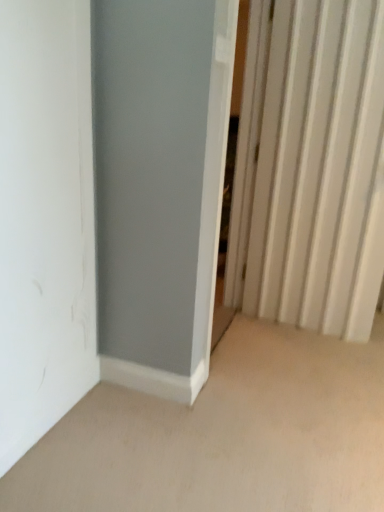
Question: From a real-world perspective, does white matte door at left stand above white plastic radiator at right?

Choices:
 (A) no
 (B) yes

Answer: (A)

Question: Can you confirm if white matte door at left is taller than white plastic radiator at right?

Choices:
 (A) yes
 (B) no

Answer: (B)

Question: Considering the relative sizes of white matte door at left and white plastic radiator at right in the image provided, is white matte door at left bigger than white plastic radiator at right?

Choices:
 (A) no
 (B) yes

Answer: (A)

Question: Considering the relative positions of white matte door at left and white plastic radiator at right in the image provided, is white matte door at left to the left of white plastic radiator at right from the viewer's perspective?

Choices:
 (A) no
 (B) yes

Answer: (B)

Question: Is white matte door at left positioned before white plastic radiator at right?

Choices:
 (A) yes
 (B) no

Answer: (A)

Question: Does white matte door at left have a lesser height compared to white plastic radiator at right?

Choices:
 (A) no
 (B) yes

Answer: (B)

Question: Does white plastic radiator at right have a larger size compared to white matte door at left?

Choices:
 (A) no
 (B) yes

Answer: (B)

Question: From a real-world perspective, is white plastic radiator at right located higher than white matte door at left?

Choices:
 (A) yes
 (B) no

Answer: (A)

Question: Is white matte door at left surrounded by white plastic radiator at right?

Choices:
 (A) yes
 (B) no

Answer: (B)

Question: From a real-world perspective, is white plastic radiator at right positioned under white matte door at left based on gravity?

Choices:
 (A) no
 (B) yes

Answer: (A)

Question: Is white plastic radiator at right positioned behind white matte door at left?

Choices:
 (A) yes
 (B) no

Answer: (A)

Question: Is white plastic radiator at right oriented away from white matte door at left?

Choices:
 (A) yes
 (B) no

Answer: (B)

Question: Considering the positions of white matte door at left and white plastic radiator at right in the image, is white matte door at left bigger or smaller than white plastic radiator at right?

Choices:
 (A) small
 (B) big

Answer: (A)